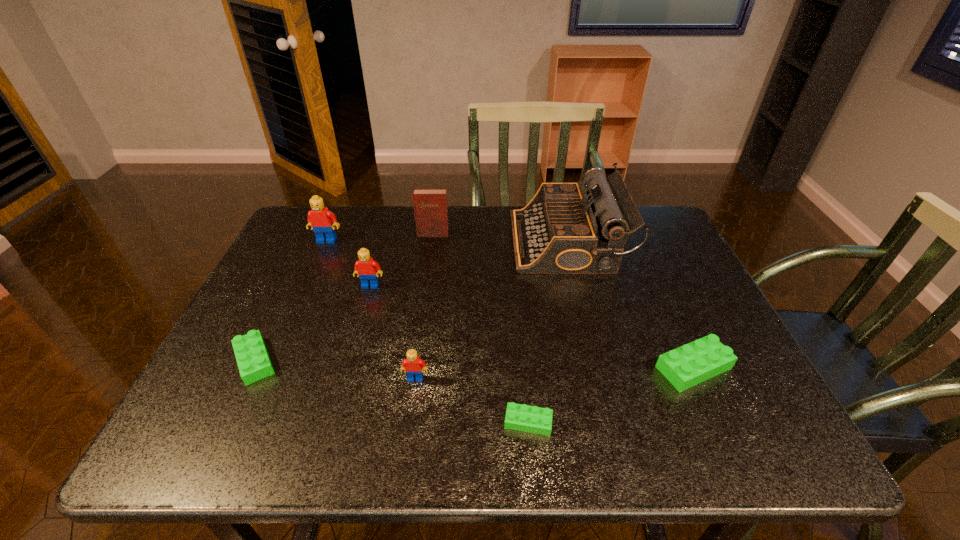
The height and width of the screenshot is (540, 960). In order to click on empty space that is in between the biggest green Lego and the second red Lego from right to left in this screenshot , I will do `click(532, 327)`.

Where is `vacant area that lies between the reddish-brown diary and the nearest red Lego`? Image resolution: width=960 pixels, height=540 pixels. vacant area that lies between the reddish-brown diary and the nearest red Lego is located at coordinates (424, 306).

At what (x,y) coordinates should I click in order to perform the action: click on free area in between the sixth tallest object and the second green Lego from right to left. Please return your answer as a coordinate pair (x, y). Looking at the image, I should click on (611, 395).

What are the coordinates of `free space between the reddish-brown diary and the rightmost red Lego` in the screenshot? It's located at (424, 306).

Find the location of a particular element. This screenshot has width=960, height=540. free space between the fourth Lego from left to right and the sixth object from right to left is located at coordinates (393, 332).

What are the coordinates of `vacant region between the nearest red Lego and the tallest object` in the screenshot? It's located at (491, 310).

The width and height of the screenshot is (960, 540). Identify the location of the sixth closest object to the third tallest Lego. (430, 204).

Identify which object is the closest to the nearest Lego. Please provide its 2D coordinates. Your answer should be formatted as a tuple, i.e. [(x, y)], where the tuple contains the x and y coordinates of a point satisfying the conditions above.

[(414, 367)]

Select which Lego appears as the second closest to the rightmost green Lego. Please provide its 2D coordinates. Your answer should be formatted as a tuple, i.e. [(x, y)], where the tuple contains the x and y coordinates of a point satisfying the conditions above.

[(414, 367)]

Identify the location of Lego object that ranks as the third closest to the third shortest object. (367, 269).